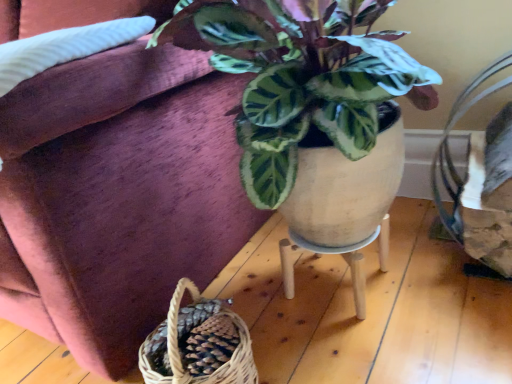
Question: Is velvet couch at upper left to the right of wooden stool at center from the viewer's perspective?

Choices:
 (A) yes
 (B) no

Answer: (B)

Question: From a real-world perspective, is velvet couch at upper left physically below wooden stool at center?

Choices:
 (A) no
 (B) yes

Answer: (A)

Question: Would you consider velvet couch at upper left to be distant from wooden stool at center?

Choices:
 (A) no
 (B) yes

Answer: (A)

Question: Does velvet couch at upper left lie in front of wooden stool at center?

Choices:
 (A) yes
 (B) no

Answer: (A)

Question: From the image's perspective, would you say velvet couch at upper left is shown under wooden stool at center?

Choices:
 (A) yes
 (B) no

Answer: (B)

Question: Can you confirm if velvet couch at upper left is smaller than wooden stool at center?

Choices:
 (A) no
 (B) yes

Answer: (A)

Question: Considering the relative sizes of wooden stool at center and velvet couch at upper left in the image provided, is wooden stool at center thinner than velvet couch at upper left?

Choices:
 (A) yes
 (B) no

Answer: (A)

Question: Could you tell me if wooden stool at center is turned towards velvet couch at upper left?

Choices:
 (A) yes
 (B) no

Answer: (B)

Question: Does wooden stool at center have a greater height compared to velvet couch at upper left?

Choices:
 (A) no
 (B) yes

Answer: (A)

Question: Could velvet couch at upper left be considered to be inside wooden stool at center?

Choices:
 (A) no
 (B) yes

Answer: (A)

Question: Is wooden stool at center located outside velvet couch at upper left?

Choices:
 (A) yes
 (B) no

Answer: (A)

Question: Is wooden stool at center further to camera compared to velvet couch at upper left?

Choices:
 (A) yes
 (B) no

Answer: (A)

Question: Does point (364, 278) appear closer or farther from the camera than point (186, 89)?

Choices:
 (A) closer
 (B) farther

Answer: (B)